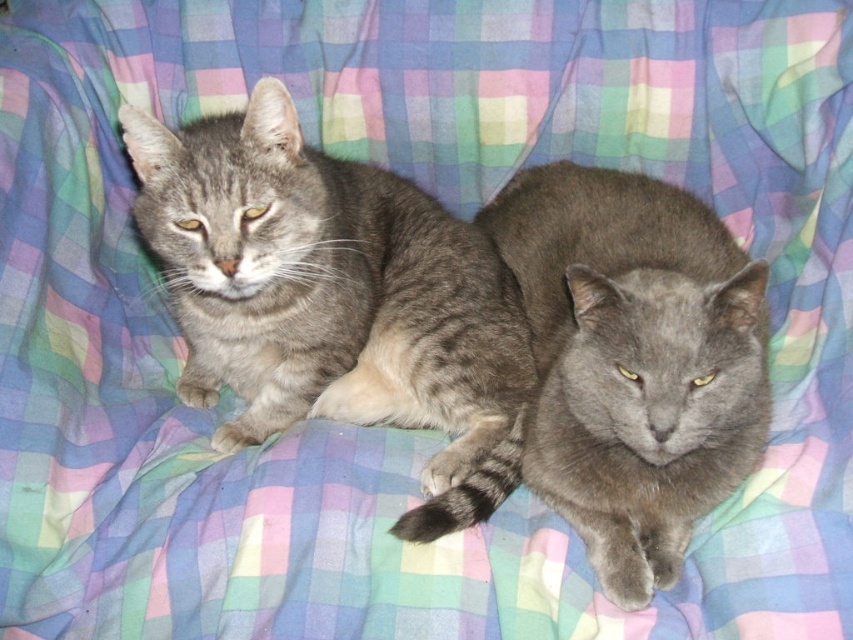
Who is higher up, gray tabby cat at left or gray fluffy cat at center?

gray tabby cat at left is higher up.

Between gray tabby cat at left and gray fluffy cat at center, which one has more height?

With more height is gray fluffy cat at center.

Identify the location of gray tabby cat at left. (334, 298).

At what (x,y) coordinates should I click in order to perform the action: click on gray tabby cat at left. Please return your answer as a coordinate pair (x, y). Looking at the image, I should click on (334, 298).